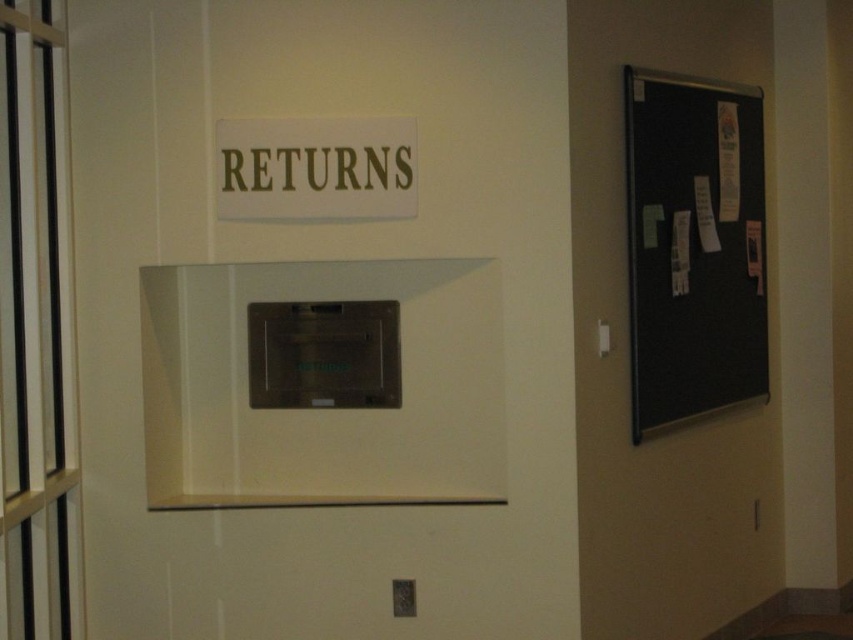
You are standing in front of the wall shown in the image. You need to place a small notice on the black feltboard at right. Where exactly should you place it?

The black feltboard at right is located at the coordinates point (693, 246).

You are a student who needs to find the returns slot for your library books. You see the black feltboard at right and the brown metallic returns at upper center. Which one is located to the right of the other?

The black feltboard at right is to the right of the brown metallic returns at upper center.

You are a maintenance worker who needs to reach the camera with a ladder. The ladder you have is 3 meters long. There is a black feltboard at right and the camera. Can you safely reach the camera using the ladder?

The black feltboard at right and the camera are 3.41 meters apart from each other. Since the ladder is only 3 meters long, it is not long enough to safely reach the camera. You need a longer ladder.